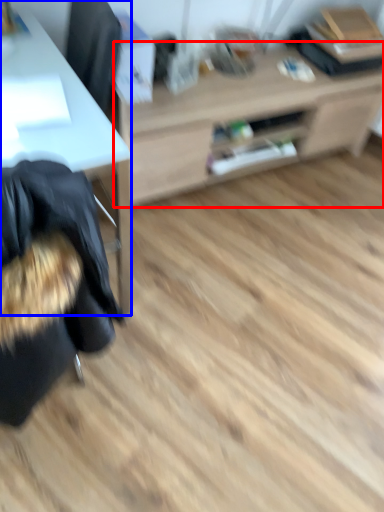
Question: Which of the following is the closest to the observer, table (highlighted by a red box) or desk (highlighted by a blue box)?

Choices:
 (A) table
 (B) desk

Answer: (B)